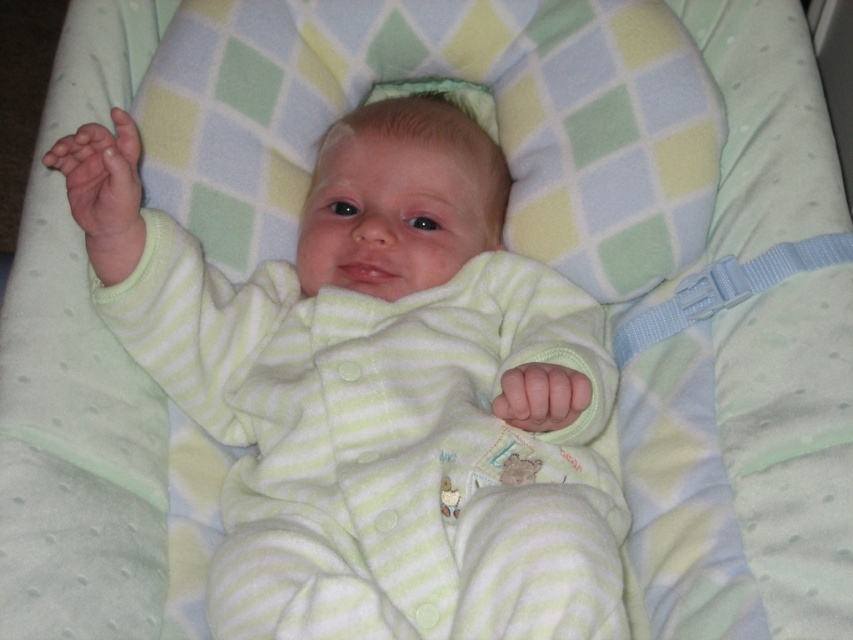
Which is more to the right, light green striped onesie at center or transparent plastic teething ring at upper left?

light green striped onesie at center

Between point (366, 580) and point (103, 154), which one is positioned in front?

Point (366, 580)

Is point (312, 472) farther from camera compared to point (105, 157)?

Yes, point (312, 472) is behind point (105, 157).

The width and height of the screenshot is (853, 640). In order to click on light green striped onesie at center in this screenshot , I will do `click(378, 392)`.